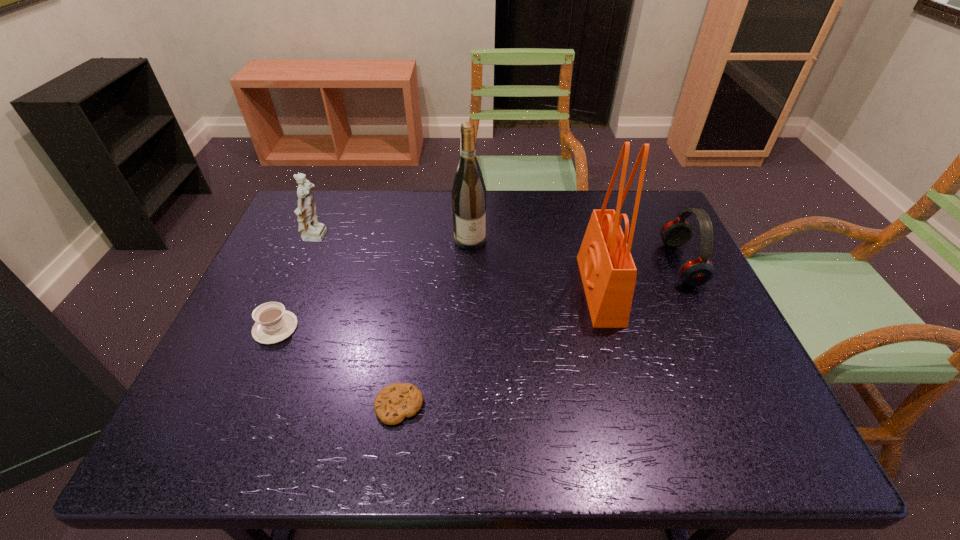
At what (x,y) coordinates should I click in order to perform the action: click on tote bag. Please return your answer as a coordinate pair (x, y). Image resolution: width=960 pixels, height=540 pixels. Looking at the image, I should click on (608, 272).

The height and width of the screenshot is (540, 960). Identify the location of the fifth shortest object. (469, 193).

Find the location of a particular element. The height and width of the screenshot is (540, 960). wine bottle is located at coordinates (469, 193).

I want to click on the third tallest object, so click(x=311, y=230).

You are a GUI agent. You are given a task and a screenshot of the screen. Output one action in this format:
    pyautogui.click(x=<x>, y=<y>)
    Task: Click on the earphone
    The width and height of the screenshot is (960, 540).
    Given the screenshot: What is the action you would take?
    pyautogui.click(x=698, y=271)

The height and width of the screenshot is (540, 960). I want to click on the rightmost object, so click(x=698, y=271).

Identify the location of teacup. Image resolution: width=960 pixels, height=540 pixels. point(274,324).

You are a GUI agent. You are given a task and a screenshot of the screen. Output one action in this format:
    pyautogui.click(x=<x>, y=<y>)
    Task: Click on the nearest object
    Image resolution: width=960 pixels, height=540 pixels.
    Given the screenshot: What is the action you would take?
    pyautogui.click(x=393, y=403)

Identify the location of the shortest object. pos(393,403).

The width and height of the screenshot is (960, 540). I want to click on vacant space located 0.070m on the logo side of the tote bag, so click(556, 290).